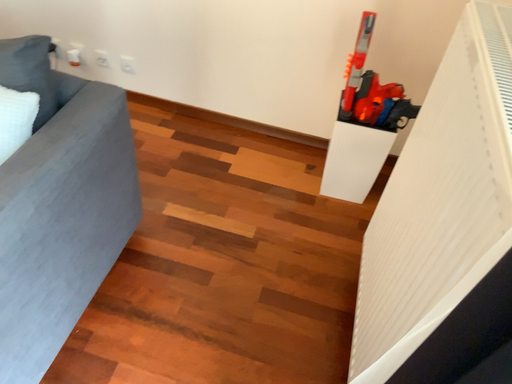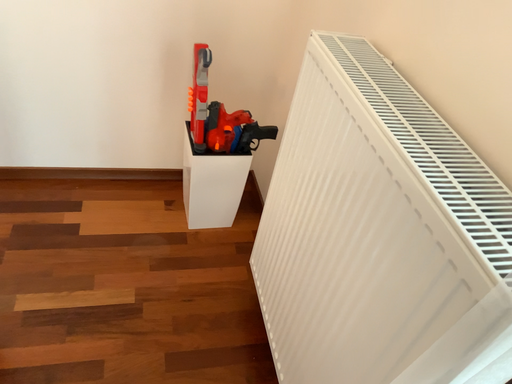
Question: Which way did the camera rotate in the video?

Choices:
 (A) rotated left
 (B) rotated right

Answer: (B)